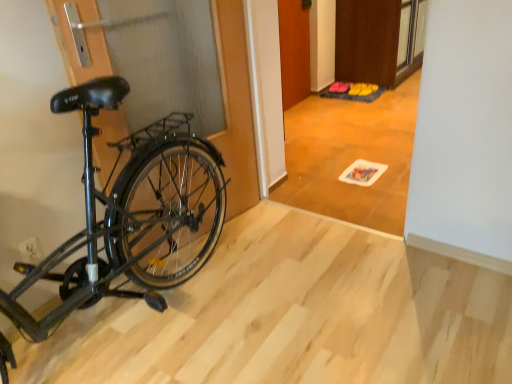
Question: Which direction should I rotate to look at wooden door at center, which is the first door in left-to-right order, — up or down?

Choices:
 (A) down
 (B) up

Answer: (B)

Question: Can you confirm if white plastic power plug at lower left is bigger than wooden door at center, which is the first door in left-to-right order?

Choices:
 (A) no
 (B) yes

Answer: (A)

Question: Is wooden door at center, the second door when ordered from right to left, inside white plastic power plug at lower left?

Choices:
 (A) no
 (B) yes

Answer: (A)

Question: Can you confirm if white plastic power plug at lower left is thinner than wooden door at center, which is the first door in left-to-right order?

Choices:
 (A) no
 (B) yes

Answer: (B)

Question: Could you tell me if white plastic power plug at lower left is turned towards wooden door at center, which is the first door in left-to-right order?

Choices:
 (A) yes
 (B) no

Answer: (B)

Question: Is white plastic power plug at lower left not close to wooden door at center, which is the first door in left-to-right order?

Choices:
 (A) no
 (B) yes

Answer: (B)

Question: Considering the relative sizes of white plastic power plug at lower left and wooden door at center, the second door when ordered from right to left, in the image provided, is white plastic power plug at lower left wider than wooden door at center, the second door when ordered from right to left,?

Choices:
 (A) no
 (B) yes

Answer: (A)

Question: Does wooden tile floor at center appear on the left side of yellow fabric shoe at center, placed as the first walking shoe when sorted from left to right?

Choices:
 (A) yes
 (B) no

Answer: (A)

Question: From a real-world perspective, is wooden tile floor at center below yellow fabric shoe at center, arranged as the second walking shoe when viewed from the right?

Choices:
 (A) no
 (B) yes

Answer: (A)

Question: Considering the relative sizes of wooden tile floor at center and yellow fabric shoe at center, placed as the first walking shoe when sorted from left to right, in the image provided, is wooden tile floor at center wider than yellow fabric shoe at center, placed as the first walking shoe when sorted from left to right,?

Choices:
 (A) yes
 (B) no

Answer: (A)

Question: Can you confirm if wooden tile floor at center is bigger than yellow fabric shoe at center, placed as the first walking shoe when sorted from left to right?

Choices:
 (A) no
 (B) yes

Answer: (B)

Question: Is wooden tile floor at center oriented towards yellow fabric shoe at center, arranged as the second walking shoe when viewed from the right?

Choices:
 (A) yes
 (B) no

Answer: (B)

Question: Can we say wooden tile floor at center lies outside yellow fabric shoe at center, arranged as the second walking shoe when viewed from the right?

Choices:
 (A) yes
 (B) no

Answer: (A)

Question: Does brown matte door at upper center, placed as the second door when sorted from left to right, have a larger size compared to white plastic power plug at lower left?

Choices:
 (A) no
 (B) yes

Answer: (B)